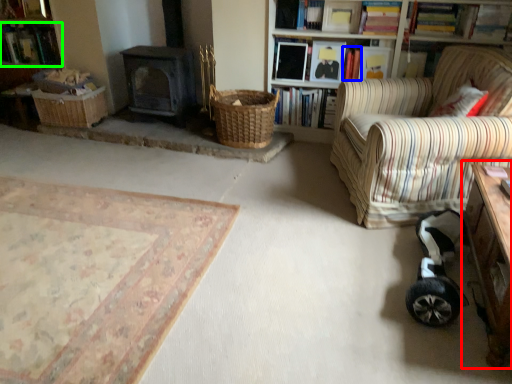
Question: Which is nearer to the table (highlighted by a red box)? book (highlighted by a blue box) or book (highlighted by a green box).

Choices:
 (A) book
 (B) book

Answer: (A)